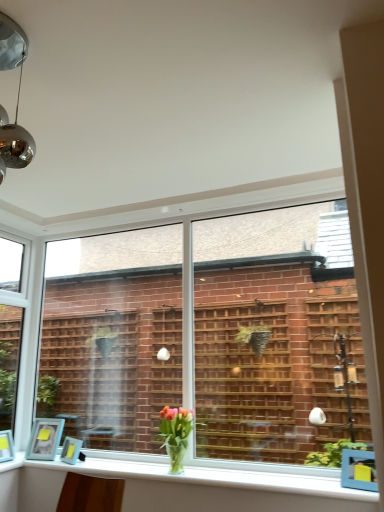
The height and width of the screenshot is (512, 384). In order to click on free spot above clear glass window at center, which appears as the 1th window when viewed from the right (from a real-world perspective) in this screenshot , I will do `click(219, 210)`.